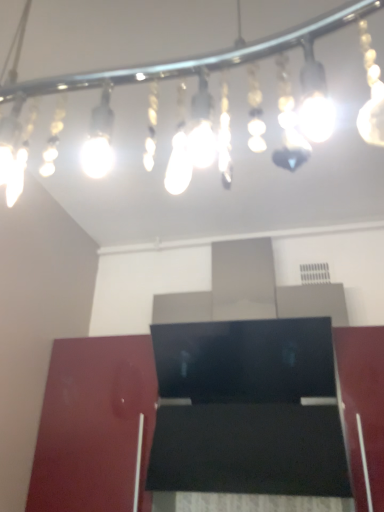
Find the location of a particular element. The height and width of the screenshot is (512, 384). translucent glass light fixture at upper center is located at coordinates (152, 75).

What do you see at coordinates (152, 75) in the screenshot? I see `translucent glass light fixture at upper center` at bounding box center [152, 75].

In order to face translucent glass light fixture at upper center, should I rotate leftwards or rightwards?

Turn right by 0.828 degrees to look at translucent glass light fixture at upper center.

Image resolution: width=384 pixels, height=512 pixels. Identify the location of glossy wood cabinet at lower left. (94, 425).

This screenshot has width=384, height=512. Describe the element at coordinates (94, 425) in the screenshot. I see `glossy wood cabinet at lower left` at that location.

Locate an element on the screen. translucent glass light fixture at upper center is located at coordinates (152, 75).

Between translucent glass light fixture at upper center and glossy wood cabinet at lower left, which one appears on the left side from the viewer's perspective?

Positioned to the left is glossy wood cabinet at lower left.

From the picture: Which object is more forward, translucent glass light fixture at upper center or glossy wood cabinet at lower left?

translucent glass light fixture at upper center is more forward.

Does point (5, 132) appear closer or farther from the camera than point (146, 346)?

Point (5, 132).

From the image's perspective, is translucent glass light fixture at upper center located above or below glossy wood cabinet at lower left?

Clearly, from the image's perspective, translucent glass light fixture at upper center is above glossy wood cabinet at lower left.

From a real-world perspective, is translucent glass light fixture at upper center located higher than glossy wood cabinet at lower left?

Correct, in the physical world, translucent glass light fixture at upper center is higher than glossy wood cabinet at lower left.

Looking at their sizes, would you say translucent glass light fixture at upper center is wider or thinner than glossy wood cabinet at lower left?

In the image, translucent glass light fixture at upper center appears to be wider than glossy wood cabinet at lower left.

Which of these two, translucent glass light fixture at upper center or glossy wood cabinet at lower left, stands shorter?

With less height is translucent glass light fixture at upper center.

Based on their sizes in the image, would you say translucent glass light fixture at upper center is bigger or smaller than glossy wood cabinet at lower left?

Considering their sizes, translucent glass light fixture at upper center takes up less space than glossy wood cabinet at lower left.

Could glossy wood cabinet at lower left be considered to be inside translucent glass light fixture at upper center?

That's incorrect, glossy wood cabinet at lower left is not inside translucent glass light fixture at upper center.

Are translucent glass light fixture at upper center and glossy wood cabinet at lower left far apart?

They are positioned close to each other.

Does translucent glass light fixture at upper center turn towards glossy wood cabinet at lower left?

No.

Find the location of a particular element. This screenshot has width=384, height=512. lamp above the glossy wood cabinet at lower left (from a real-world perspective) is located at coordinates (152, 75).

Is glossy wood cabinet at lower left to the right of translucent glass light fixture at upper center from the viewer's perspective?

In fact, glossy wood cabinet at lower left is to the left of translucent glass light fixture at upper center.

Which object is more forward, glossy wood cabinet at lower left or translucent glass light fixture at upper center?

translucent glass light fixture at upper center is more forward.

Is point (111, 509) more distant than point (167, 186)?

No, (111, 509) is in front of (167, 186).

From the image's perspective, would you say glossy wood cabinet at lower left is shown under translucent glass light fixture at upper center?

Indeed, from the image's perspective, glossy wood cabinet at lower left is shown beneath translucent glass light fixture at upper center.

From a real-world perspective, which is physically below, glossy wood cabinet at lower left or translucent glass light fixture at upper center?

glossy wood cabinet at lower left is physically lower.

In the scene shown: Considering the sizes of objects glossy wood cabinet at lower left and translucent glass light fixture at upper center in the image provided, who is thinner, glossy wood cabinet at lower left or translucent glass light fixture at upper center?

glossy wood cabinet at lower left is thinner.

Considering the sizes of objects glossy wood cabinet at lower left and translucent glass light fixture at upper center in the image provided, who is shorter, glossy wood cabinet at lower left or translucent glass light fixture at upper center?

With less height is translucent glass light fixture at upper center.

Who is smaller, glossy wood cabinet at lower left or translucent glass light fixture at upper center?

With smaller size is translucent glass light fixture at upper center.

Is glossy wood cabinet at lower left located outside translucent glass light fixture at upper center?

Indeed, glossy wood cabinet at lower left is completely outside translucent glass light fixture at upper center.

Is glossy wood cabinet at lower left with translucent glass light fixture at upper center?

No, glossy wood cabinet at lower left is not touching translucent glass light fixture at upper center.

Is translucent glass light fixture at upper center at the back of glossy wood cabinet at lower left?

No, glossy wood cabinet at lower left is not facing away from translucent glass light fixture at upper center.

Could you measure the distance between glossy wood cabinet at lower left and translucent glass light fixture at upper center?

glossy wood cabinet at lower left is 84.89 centimeters from translucent glass light fixture at upper center.

What are the coordinates of `lamp located above the glossy wood cabinet at lower left (from a real-world perspective)` in the screenshot? It's located at (152, 75).

The image size is (384, 512). Find the location of `lamp on the right of glossy wood cabinet at lower left`. lamp on the right of glossy wood cabinet at lower left is located at coordinates (152, 75).

The height and width of the screenshot is (512, 384). There is a glossy wood cabinet at lower left. What are the coordinates of `lamp above it (from a real-world perspective)` in the screenshot? It's located at (152, 75).